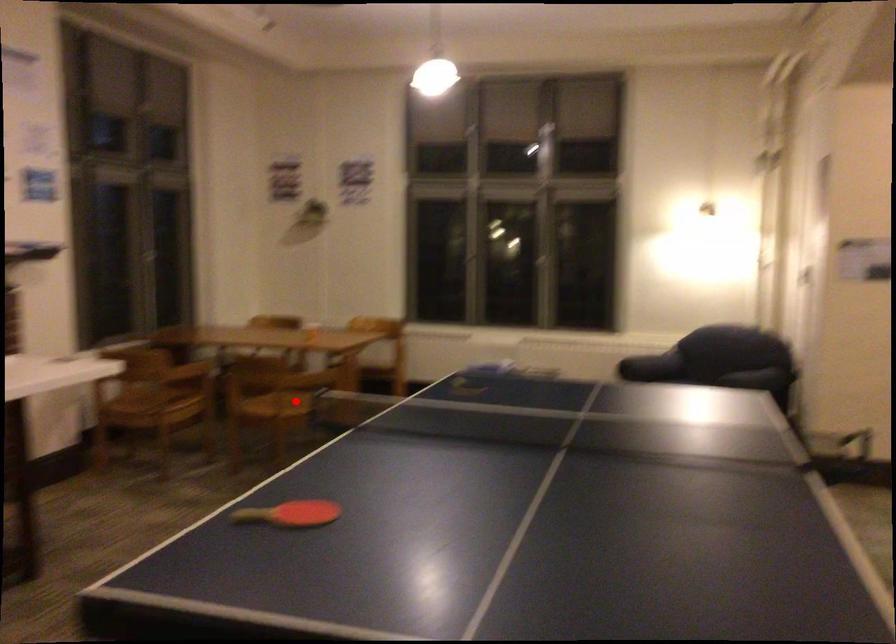
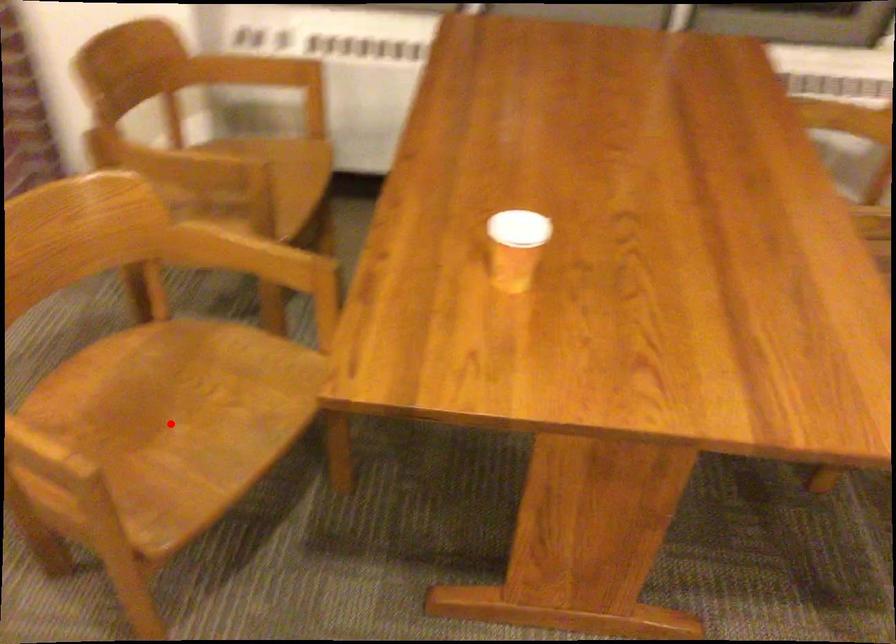
I am providing you with two images of the same scene from different viewpoints. A red point is marked on the first image and another point is marked on the second image. Do the highlighted points in image1 and image2 indicate the same real-world spot?

Yes